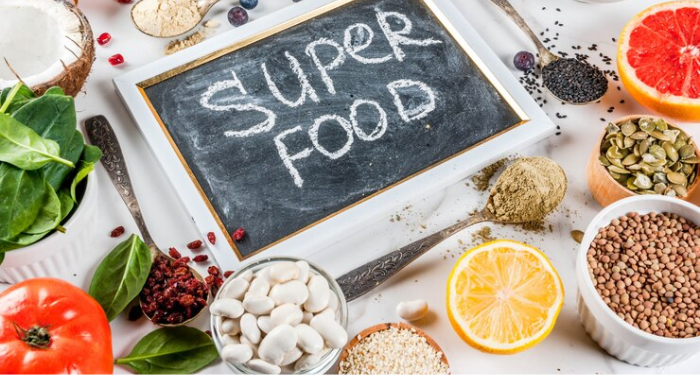
Identify the location of blackboard. (244, 160).